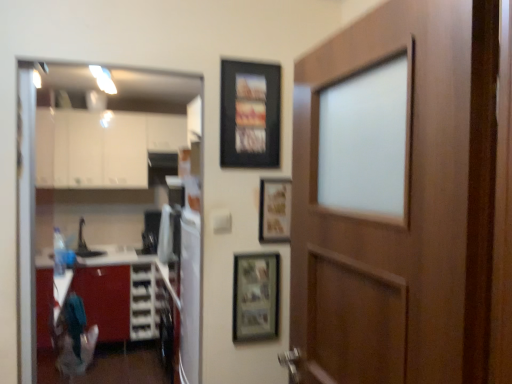
Question: Does wooden-framed photo at center, the third picture frame viewed from the top, appear on the left side of wooden door at right?

Choices:
 (A) yes
 (B) no

Answer: (A)

Question: Is wooden door at right a part of wooden-framed photo at center, marked as the first picture frame in a bottom-to-top arrangement?

Choices:
 (A) no
 (B) yes

Answer: (A)

Question: Can you confirm if wooden-framed photo at center, the third picture frame viewed from the top, is positioned to the right of wooden door at right?

Choices:
 (A) no
 (B) yes

Answer: (A)

Question: Would you say wooden-framed photo at center, the third picture frame viewed from the top, is outside wooden door at right?

Choices:
 (A) yes
 (B) no

Answer: (A)

Question: From a real-world perspective, is wooden-framed photo at center, the third picture frame viewed from the top, positioned under wooden door at right based on gravity?

Choices:
 (A) yes
 (B) no

Answer: (A)

Question: Is black matte picture frame at upper center, which is counted as the 1th picture frame, starting from the top, inside or outside of wooden-framed photo at center, the third picture frame viewed from the top?

Choices:
 (A) outside
 (B) inside

Answer: (A)

Question: From the image's perspective, is black matte picture frame at upper center, the third picture frame from the bottom, positioned above or below wooden-framed photo at center, the third picture frame viewed from the top?

Choices:
 (A) below
 (B) above

Answer: (B)

Question: Considering the relative positions of black matte picture frame at upper center, the third picture frame from the bottom, and wooden-framed photo at center, the third picture frame viewed from the top, in the image provided, is black matte picture frame at upper center, the third picture frame from the bottom, to the left or to the right of wooden-framed photo at center, the third picture frame viewed from the top,?

Choices:
 (A) left
 (B) right

Answer: (A)

Question: Is black matte picture frame at upper center, the third picture frame from the bottom, bigger or smaller than wooden-framed photo at center, marked as the first picture frame in a bottom-to-top arrangement?

Choices:
 (A) small
 (B) big

Answer: (B)

Question: From the image's perspective, relative to wooden door at right, is wooden-framed photo at center, the third picture frame viewed from the top, above or below?

Choices:
 (A) above
 (B) below

Answer: (B)

Question: Is wooden-framed photo at center, marked as the first picture frame in a bottom-to-top arrangement, taller or shorter than wooden door at right?

Choices:
 (A) tall
 (B) short

Answer: (B)

Question: From a real-world perspective, is wooden-framed photo at center, marked as the first picture frame in a bottom-to-top arrangement, above or below wooden door at right?

Choices:
 (A) below
 (B) above

Answer: (A)

Question: In the image, is wooden-framed photo at center, the third picture frame viewed from the top, positioned in front of or behind wooden door at right?

Choices:
 (A) front
 (B) behind

Answer: (B)

Question: Is transparent glass door at left bigger or smaller than wooden picture frame at center, the 2th picture frame in the top-to-bottom sequence?

Choices:
 (A) small
 (B) big

Answer: (B)

Question: Considering the relative positions of transparent glass door at left and wooden picture frame at center, arranged as the 2th picture frame when ordered from the bottom, in the image provided, is transparent glass door at left to the left or to the right of wooden picture frame at center, arranged as the 2th picture frame when ordered from the bottom,?

Choices:
 (A) right
 (B) left

Answer: (B)